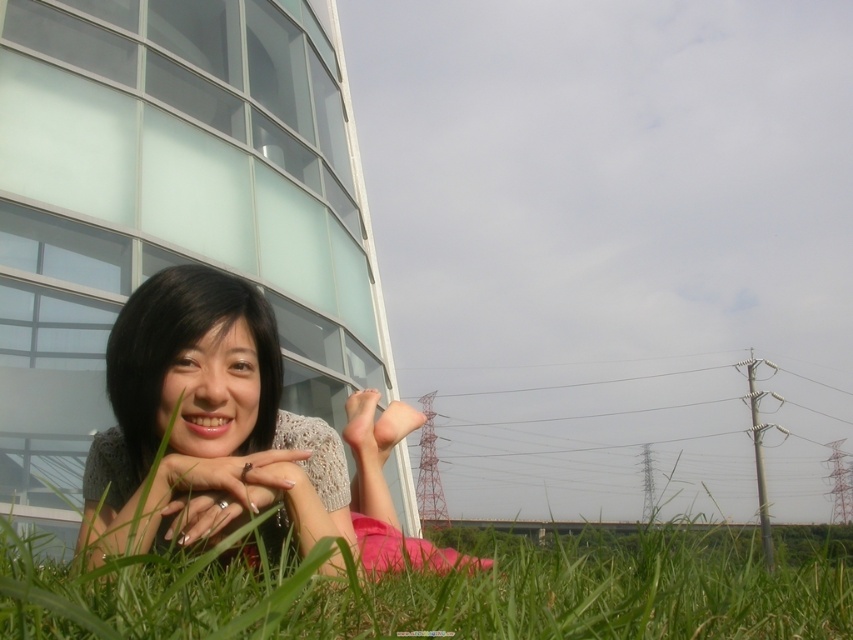
Is green grass at lower center thinner than smooth skin girl at center?

No, green grass at lower center is not thinner than smooth skin girl at center.

Looking at this image, can you confirm if green grass at lower center is positioned to the right of smooth skin girl at center?

Indeed, green grass at lower center is positioned on the right side of smooth skin girl at center.

Locate an element on the screen. green grass at lower center is located at coordinates (456, 592).

Which is above, smooth skin girl at center or nail polish at center?

nail polish at center is above.

Between point (125, 492) and point (247, 490), which one is positioned in front?

Point (247, 490) is more forward.

The image size is (853, 640). What are the coordinates of `smooth skin girl at center` in the screenshot? It's located at (234, 435).

Does green grass at lower center have a lesser width compared to nail polish at center?

No.

Who is more distant from viewer, (x=24, y=548) or (x=297, y=460)?

The point (x=297, y=460) is behind.

Identify the location of green grass at lower center. (456, 592).